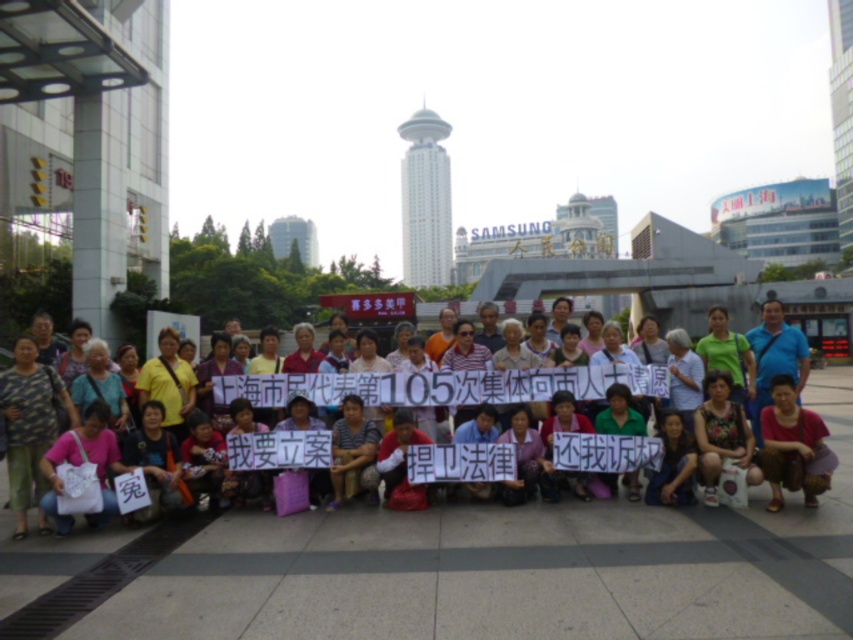
In the scene shown: You are a photographer standing at the edge of the plaza, and you want to take a photo that includes both the matte pink shirt at center and the matte pink blouse at center. What is the minimum distance you need to move backward to ensure both are in frame?

The matte pink shirt at center and matte pink blouse at center are 7.67 feet apart from each other. To include both in the frame, you need to move backward until the camera can capture a field of view that accommodates this distance. Assuming a typical smartphone camera with a 46.7 degree diagonal field of view, the minimum distance required would be approximately 7.67 feet divided by the tangent of half the field of view angle. Calculating tan 23.35 degrees gives about 0.433. Thus, 7.67 feet divided by 0.4

You are a photographer trying to capture a clear photo of both the matte pink shirt at center and the matte pink blouse at center. Since they are both pink and in the same area, which one will be easier to distinguish in the photo?

The matte pink shirt at center will be easier to distinguish because it has a larger size compared to the matte pink blouse at center.